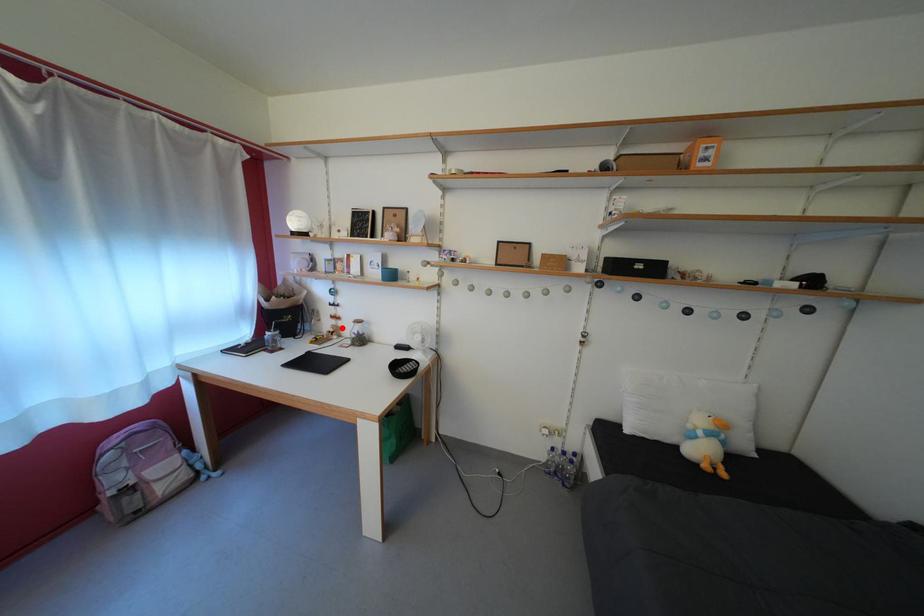
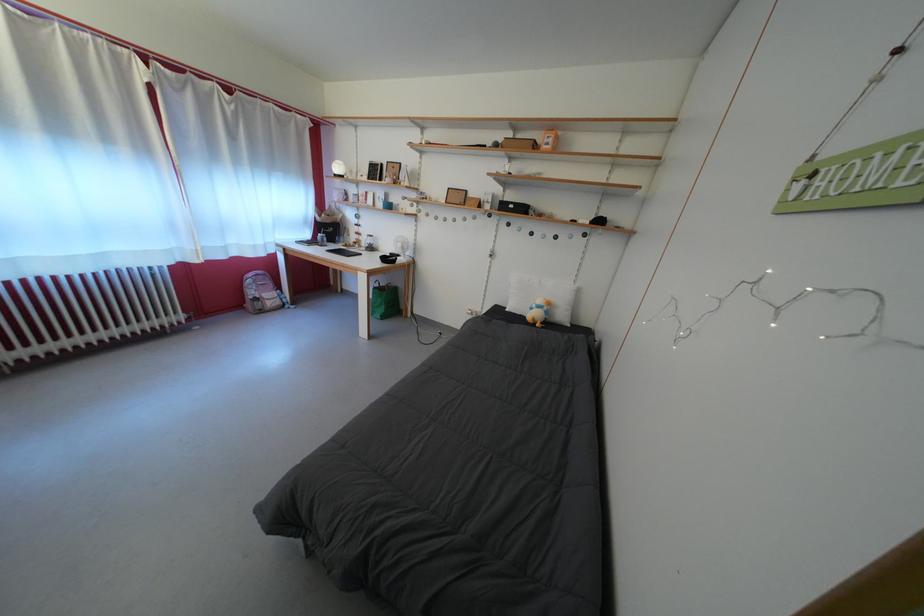
Question: I am providing you with two images of the same scene from different viewpoints. Given a red point in image1, look at the same physical point in image2. Is it:

Choices:
 (A) Closer to the viewpoint
 (B) Farther from the viewpoint

Answer: (A)